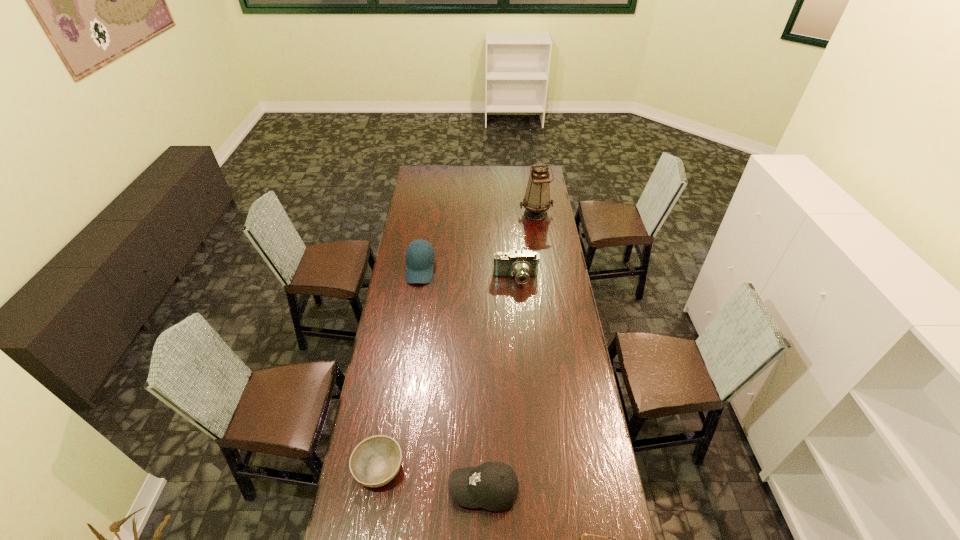
In order to click on object that stands as the third closest to the left baseball cap in this screenshot , I will do [375, 461].

Locate which object ranks in proximity to the farthest object. Please provide its 2D coordinates. Your answer should be formatted as a tuple, i.e. [(x, y)], where the tuple contains the x and y coordinates of a point satisfying the conditions above.

[(522, 265)]

You are a GUI agent. You are given a task and a screenshot of the screen. Output one action in this format:
    pyautogui.click(x=<x>, y=<y>)
    Task: Click on the vacant area in the image that satisfies the following two spatial constraints: 1. on the front side of the tallest object; 2. on the front-facing side of the shorter baseball cap
    
    Given the screenshot: What is the action you would take?
    [578, 490]

What are the coordinates of `blank area in the image that satisfies the following two spatial constraints: 1. on the front-facing side of the camcorder; 2. on the front-facing side of the shorter baseball cap` in the screenshot? It's located at (534, 490).